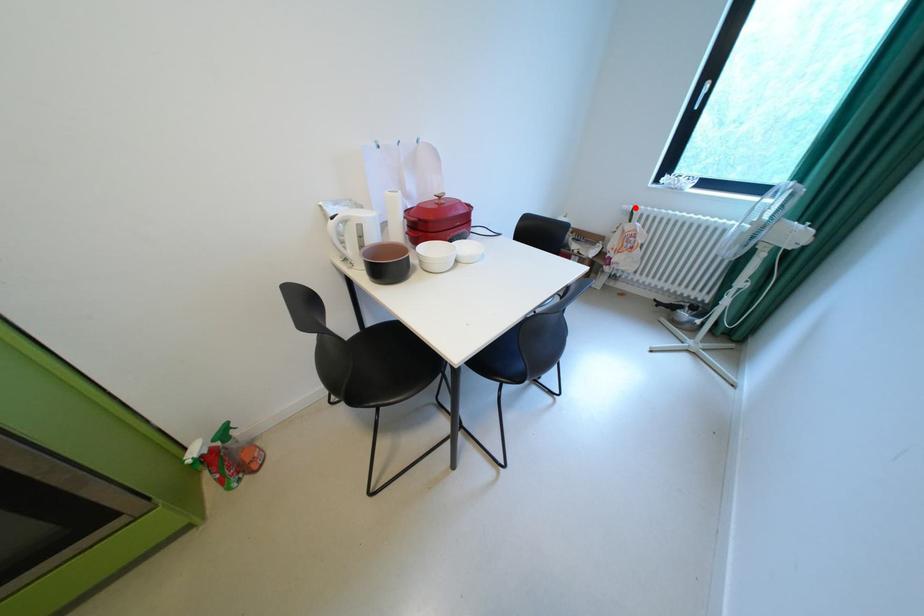
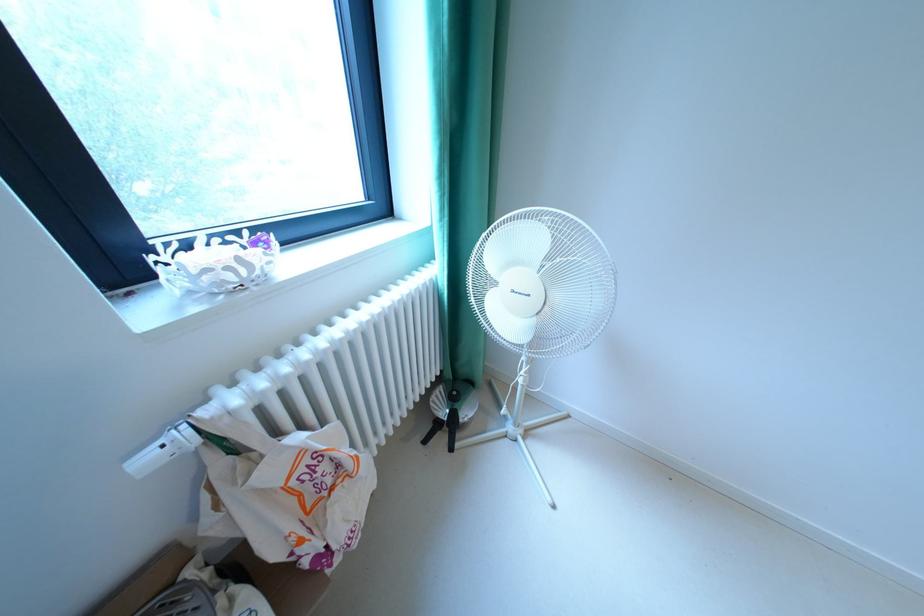
In the second image, find the point that corresponds to the highlighted location in the first image.

(156, 460)